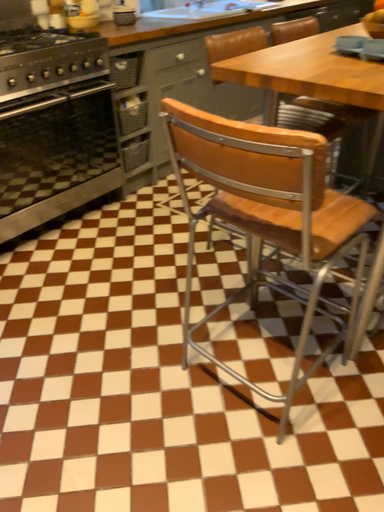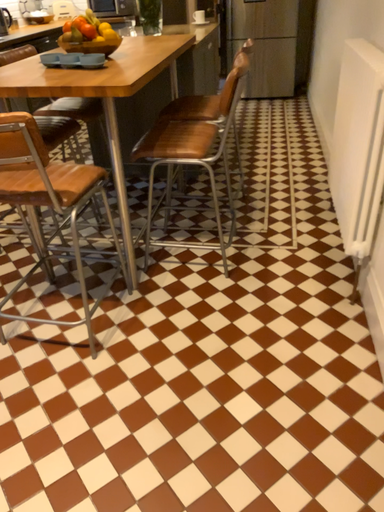
Question: How did the camera likely rotate when shooting the video?

Choices:
 (A) rotated upward
 (B) rotated downward

Answer: (A)